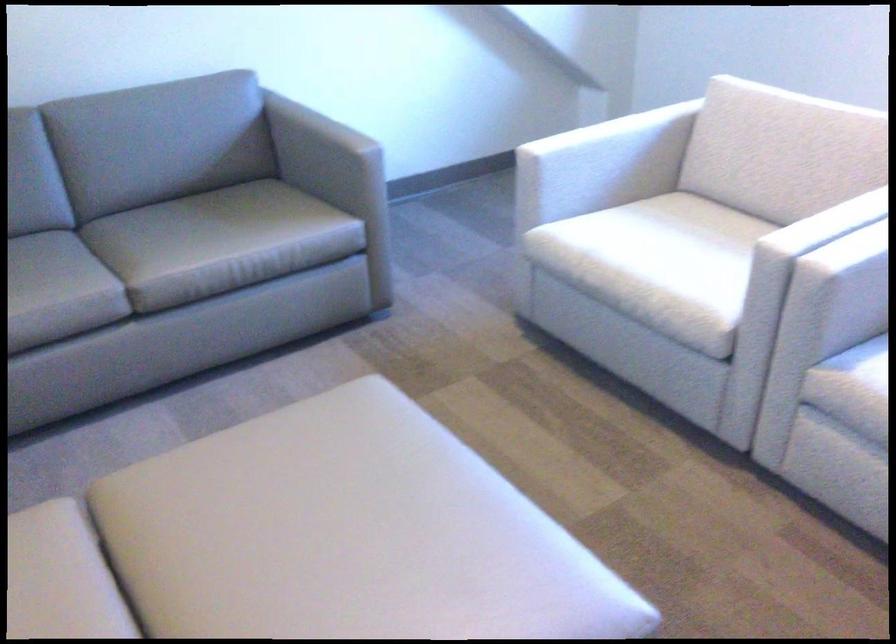
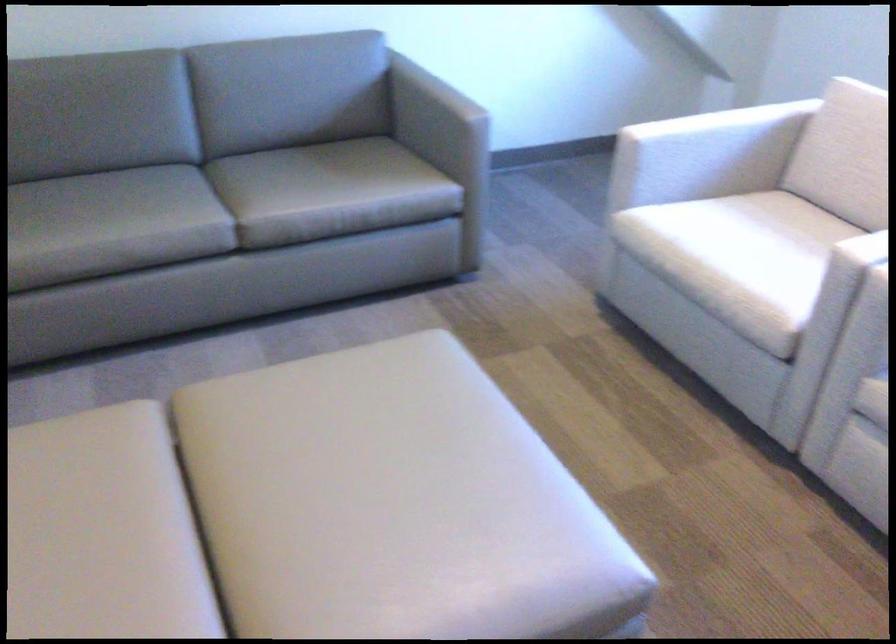
Locate, in the second image, the point that corresponds to pixel 615 128 in the first image.

(719, 120)